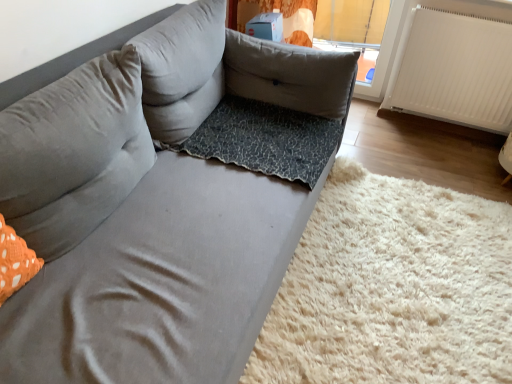
The width and height of the screenshot is (512, 384). What do you see at coordinates (73, 153) in the screenshot?
I see `gray fabric pillow at upper left, which is counted as the 1th pillow, starting from the left` at bounding box center [73, 153].

Where is `gray fabric pillow at upper left, which is counted as the 1th pillow, starting from the left`? The width and height of the screenshot is (512, 384). gray fabric pillow at upper left, which is counted as the 1th pillow, starting from the left is located at coordinates (73, 153).

Image resolution: width=512 pixels, height=384 pixels. What do you see at coordinates (290, 75) in the screenshot?
I see `leopard print cushion at center, which appears as the third pillow when viewed from the left` at bounding box center [290, 75].

Describe the element at coordinates (454, 68) in the screenshot. I see `white ribbed radiator at right` at that location.

The height and width of the screenshot is (384, 512). Describe the element at coordinates (392, 288) in the screenshot. I see `leopard print fabric at lower right` at that location.

Identify the location of gray fabric pillow at upper left, which is counted as the third pillow, starting from the right. (73, 153).

Considering the positions of points (31, 191) and (46, 121), is point (31, 191) farther from camera compared to point (46, 121)?

No, it is not.

Is gray fabric pillow at upper left, which is counted as the third pillow, starting from the right, at the right side of suede gray couch at center?

No.

How many degrees apart are the facing directions of gray fabric pillow at upper left, which is counted as the third pillow, starting from the right, and suede gray couch at center?

The facing directions of gray fabric pillow at upper left, which is counted as the third pillow, starting from the right, and suede gray couch at center are 3.16 degrees apart.

Would you consider leopard print fabric dog bed at center to be distant from gray fabric pillow at upper left, which is counted as the 1th pillow, starting from the left?

No.

Is leopard print fabric dog bed at center bigger or smaller than gray fabric pillow at upper left, which is counted as the 1th pillow, starting from the left?

In the image, leopard print fabric dog bed at center appears to be smaller than gray fabric pillow at upper left, which is counted as the 1th pillow, starting from the left.

Is the position of leopard print fabric dog bed at center more distant than that of gray fabric pillow at upper left, which is counted as the third pillow, starting from the right?

Yes, the depth of leopard print fabric dog bed at center is greater than that of gray fabric pillow at upper left, which is counted as the third pillow, starting from the right.

Find the location of `dog bed above the gray fabric pillow at upper left, which is counted as the third pillow, starting from the right (from the image's perspective)`. dog bed above the gray fabric pillow at upper left, which is counted as the third pillow, starting from the right (from the image's perspective) is located at coordinates (266, 139).

Find the location of a particular element. Image resolution: width=512 pixels, height=384 pixels. studio couch on the left of leopard print fabric dog bed at center is located at coordinates (150, 218).

Can you confirm if leopard print fabric dog bed at center is shorter than suede gray couch at center?

Indeed, leopard print fabric dog bed at center has a lesser height compared to suede gray couch at center.

From a real-world perspective, is leopard print fabric dog bed at center under suede gray couch at center?

Correct, in the physical world, leopard print fabric dog bed at center is lower than suede gray couch at center.

Considering the relative positions of leopard print fabric dog bed at center and suede gray couch at center in the image provided, is leopard print fabric dog bed at center in front of suede gray couch at center?

No, it is behind suede gray couch at center.

Is leopard print cushion at center, which appears as the third pillow when viewed from the left, at the right side of leopard print fabric at lower right?

No.

From the image's perspective, does leopard print cushion at center, which appears as the third pillow when viewed from the left, appear higher than leopard print fabric at lower right?

Correct, leopard print cushion at center, which appears as the third pillow when viewed from the left, appears higher than leopard print fabric at lower right in the image.

In terms of width, does leopard print cushion at center, placed as the first pillow when sorted from right to left, look wider or thinner when compared to leopard print fabric at lower right?

In the image, leopard print cushion at center, placed as the first pillow when sorted from right to left, appears to be more narrow than leopard print fabric at lower right.

Are leopard print cushion at center, which appears as the third pillow when viewed from the left, and leopard print fabric at lower right far apart?

leopard print cushion at center, which appears as the third pillow when viewed from the left, is near leopard print fabric at lower right, not far away.

Which is more to the left, suede gray couch at center or leopard print cushion at center, placed as the first pillow when sorted from right to left?

suede gray couch at center.

Which is behind, point (35, 220) or point (345, 101)?

The point (345, 101) is farther from the camera.

Is suede gray couch at center far away from leopard print cushion at center, placed as the first pillow when sorted from right to left?

No.

Consider the image. From a real-world perspective, who is located higher, gray fabric pillow at upper left, which is counted as the 1th pillow, starting from the left, or white ribbed radiator at right?

gray fabric pillow at upper left, which is counted as the 1th pillow, starting from the left.

Does gray fabric pillow at upper left, which is counted as the third pillow, starting from the right, touch white ribbed radiator at right?

gray fabric pillow at upper left, which is counted as the third pillow, starting from the right, and white ribbed radiator at right are clearly separated.

Which is less distant, (141,151) or (400,77)?

Clearly, point (141,151) is closer to the camera than point (400,77).

Considering the sizes of objects leopard print fabric dog bed at center and gray fabric pillow at center, arranged as the second pillow when viewed from the right, in the image provided, who is bigger, leopard print fabric dog bed at center or gray fabric pillow at center, arranged as the second pillow when viewed from the right,?

gray fabric pillow at center, arranged as the second pillow when viewed from the right.

Which object is closer to the camera taking this photo, leopard print fabric dog bed at center or gray fabric pillow at center, which ranks as the second pillow in left-to-right order?

Positioned in front is gray fabric pillow at center, which ranks as the second pillow in left-to-right order.

Is point (242, 109) positioned in front of point (178, 70)?

No, it is not.

Is the surface of leopard print fabric dog bed at center in direct contact with gray fabric pillow at center, arranged as the second pillow when viewed from the right?

No, leopard print fabric dog bed at center is not making contact with gray fabric pillow at center, arranged as the second pillow when viewed from the right.

From a real-world perspective, starting from the suede gray couch at center, which pillow is the 2nd one vertically above it? Please provide its 2D coordinates.

[(73, 153)]

Identify the location of dog bed located on the right of gray fabric pillow at upper left, which is counted as the third pillow, starting from the right. (266, 139).

Which object lies nearer to the anchor point gray fabric pillow at upper left, which is counted as the 1th pillow, starting from the left, leopard print fabric at lower right or leopard print fabric dog bed at center?

leopard print fabric dog bed at center is positioned closer to the anchor gray fabric pillow at upper left, which is counted as the 1th pillow, starting from the left.

Estimate the real-world distances between objects in this image. Which object is further from leopard print cushion at center, which appears as the third pillow when viewed from the left, leopard print fabric at lower right or gray fabric pillow at upper left, which is counted as the 1th pillow, starting from the left?

The object further to leopard print cushion at center, which appears as the third pillow when viewed from the left, is gray fabric pillow at upper left, which is counted as the 1th pillow, starting from the left.

From the picture: Estimate the real-world distances between objects in this image. Which object is closer to suede gray couch at center, leopard print fabric dog bed at center or gray fabric pillow at center, arranged as the second pillow when viewed from the right?

Among the two, gray fabric pillow at center, arranged as the second pillow when viewed from the right, is located nearer to suede gray couch at center.

When comparing their distances from gray fabric pillow at center, which ranks as the second pillow in left-to-right order, does leopard print cushion at center, placed as the first pillow when sorted from right to left, or white ribbed radiator at right seem further?

white ribbed radiator at right is further to gray fabric pillow at center, which ranks as the second pillow in left-to-right order.

From the image, which object appears to be nearer to gray fabric pillow at center, which ranks as the second pillow in left-to-right order, white ribbed radiator at right or leopard print fabric dog bed at center?

leopard print fabric dog bed at center lies closer to gray fabric pillow at center, which ranks as the second pillow in left-to-right order, than the other object.

Considering their positions, is suede gray couch at center positioned further to leopard print fabric at lower right than leopard print fabric dog bed at center?

suede gray couch at center lies further to leopard print fabric at lower right than the other object.

Which object lies nearer to the anchor point white ribbed radiator at right, leopard print fabric at lower right or leopard print cushion at center, which appears as the third pillow when viewed from the left?

Based on the image, leopard print cushion at center, which appears as the third pillow when viewed from the left, appears to be nearer to white ribbed radiator at right.

Considering their positions, is leopard print fabric at lower right positioned closer to gray fabric pillow at center, arranged as the second pillow when viewed from the right, than gray fabric pillow at upper left, which is counted as the third pillow, starting from the right?

The object closer to gray fabric pillow at center, arranged as the second pillow when viewed from the right, is gray fabric pillow at upper left, which is counted as the third pillow, starting from the right.

Locate an element on the screen. The image size is (512, 384). mat between suede gray couch at center and leopard print fabric dog bed at center from front to back is located at coordinates (392, 288).

This screenshot has height=384, width=512. I want to click on mat positioned between suede gray couch at center and white ribbed radiator at right from near to far, so click(x=392, y=288).

Find the location of a particular element. dog bed between gray fabric pillow at upper left, which is counted as the 1th pillow, starting from the left, and leopard print fabric at lower right from left to right is located at coordinates (266, 139).

The image size is (512, 384). Find the location of `pillow between suede gray couch at center and gray fabric pillow at center, arranged as the second pillow when viewed from the right, from front to back`. pillow between suede gray couch at center and gray fabric pillow at center, arranged as the second pillow when viewed from the right, from front to back is located at coordinates (73, 153).